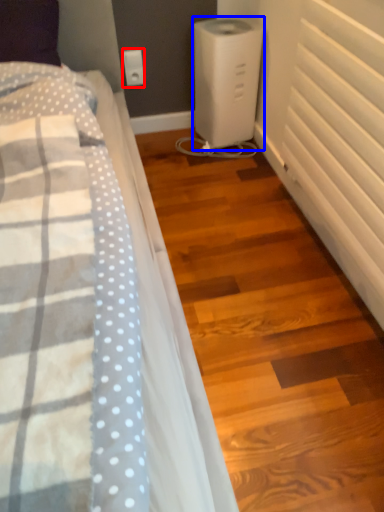
Question: Which point is further to the camera, electric outlet (highlighted by a red box) or home appliance (highlighted by a blue box)?

Choices:
 (A) electric outlet
 (B) home appliance

Answer: (A)